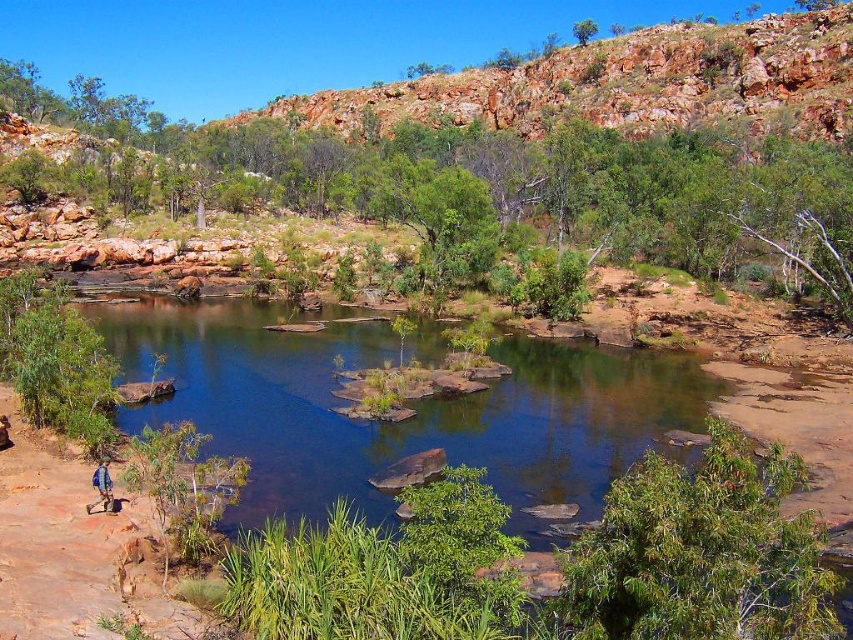
You are standing at the edge of the scene and want to reach the clear water at center. Which direction should you move in to get there?

Since the clear water at center is located at point 0.658 on the x axis and 0.474 on the y axis, you should move towards the center of the scene to reach it.

You are hiking and see the clear water at center and the blue fabric backpack at lower left. Which object is positioned higher in the image?

The clear water at center is located above the blue fabric backpack at lower left, so it is positioned higher in the image.